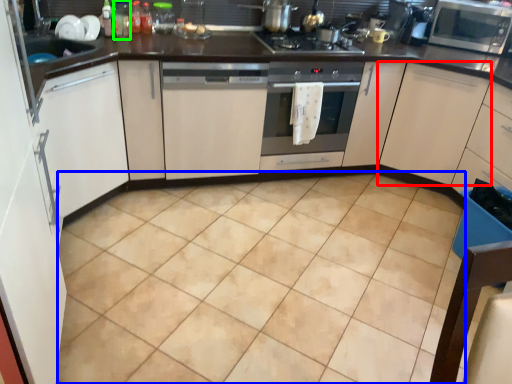
Question: Which object is the closest to the cabinetry (highlighted by a red box)? Choose among these: ceramic tile (highlighted by a blue box) or bottle (highlighted by a green box).

Choices:
 (A) ceramic tile
 (B) bottle

Answer: (A)